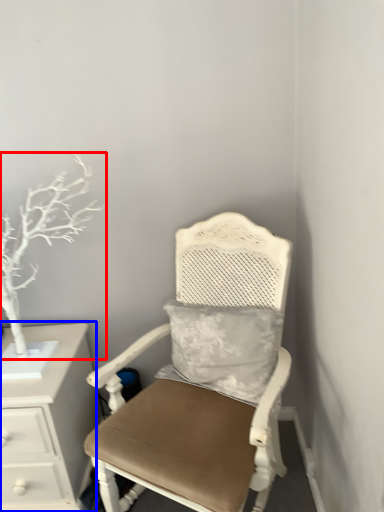
Question: Which of the following is the closest to the observer, tree (highlighted by a red box) or chest of drawers (highlighted by a blue box)?

Choices:
 (A) tree
 (B) chest of drawers

Answer: (A)